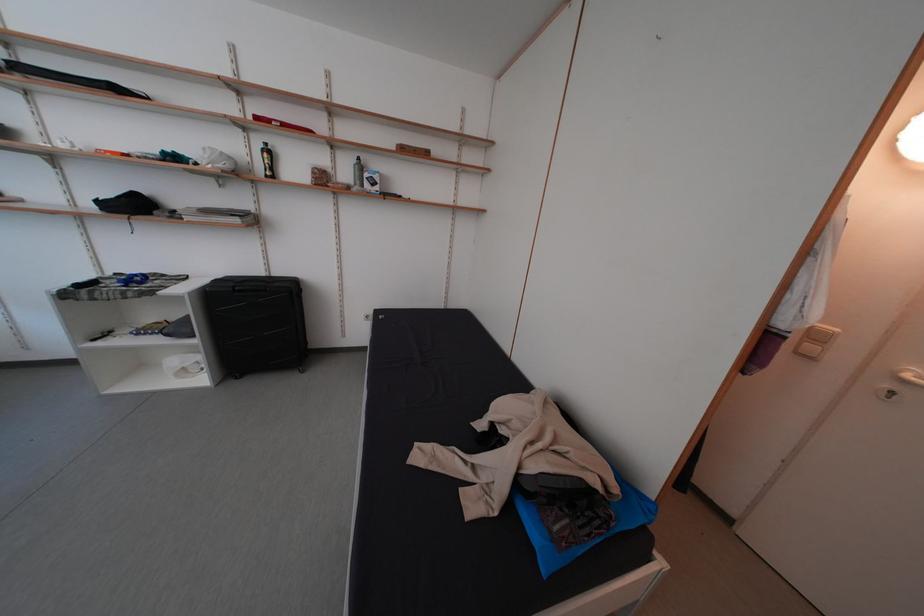
What do you see at coordinates (250, 281) in the screenshot?
I see `the black suitcase handle` at bounding box center [250, 281].